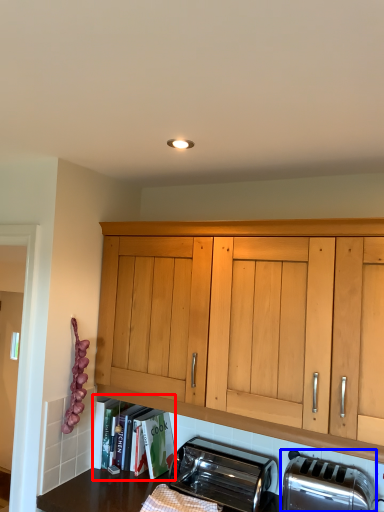
Question: Which point is further to the camera, shelf (highlighted by a red box) or toaster (highlighted by a blue box)?

Choices:
 (A) shelf
 (B) toaster

Answer: (A)